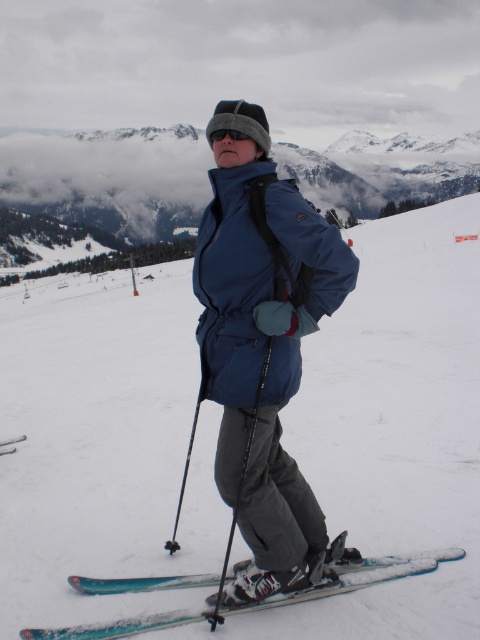
Question: Among these objects, which one is farthest from the camera?

Choices:
 (A) blue metallic ski at lower left
 (B) black matte goggles at center

Answer: (A)

Question: Can you confirm if blue matte jacket at center is wider than blue metallic ski at lower left?

Choices:
 (A) yes
 (B) no

Answer: (A)

Question: Can you confirm if blue matte jacket at center is thinner than teal glossy skis at lower center?

Choices:
 (A) yes
 (B) no

Answer: (A)

Question: Which object is positioned closest to the black matte goggles at center?

Choices:
 (A) blue fabric ski slope at center
 (B) blue matte jacket at center
 (C) teal glossy skis at lower center
 (D) blue metallic ski at lower left

Answer: (B)

Question: Which point is farther to the camera?

Choices:
 (A) (254, 280)
 (B) (211, 138)
 (C) (442, 294)

Answer: (C)

Question: Can you confirm if teal glossy skis at lower center is thinner than black matte goggles at center?

Choices:
 (A) no
 (B) yes

Answer: (A)